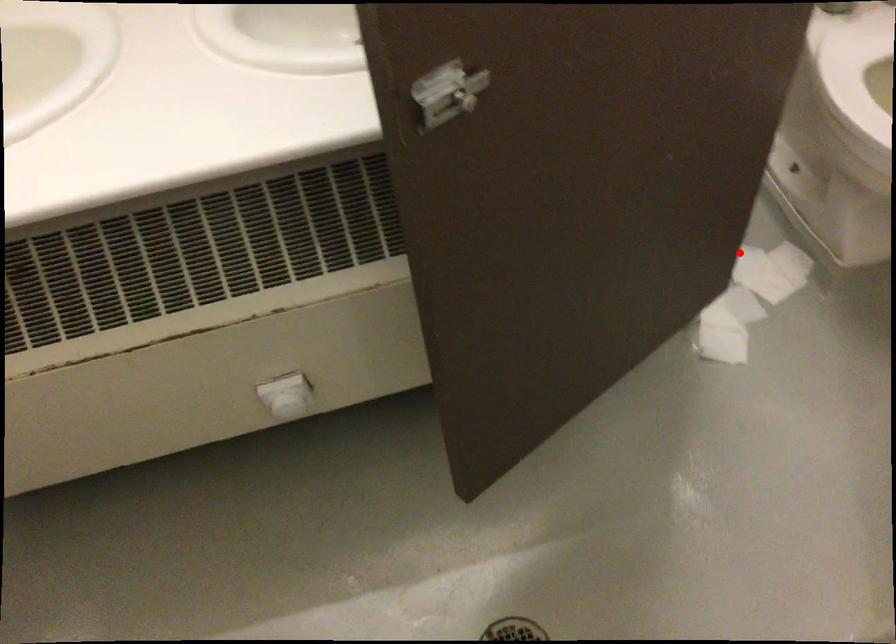
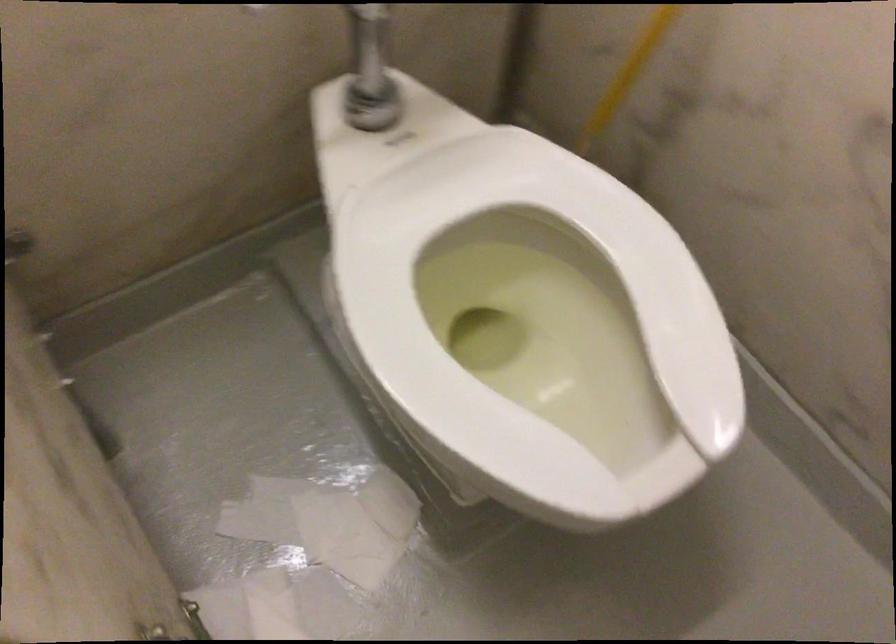
Question: I am providing you with two images of the same scene from different viewpoints. Given a red point in image1, look at the same physical point in image2. Is it:

Choices:
 (A) Closer to the viewpoint
 (B) Farther from the viewpoint

Answer: (A)